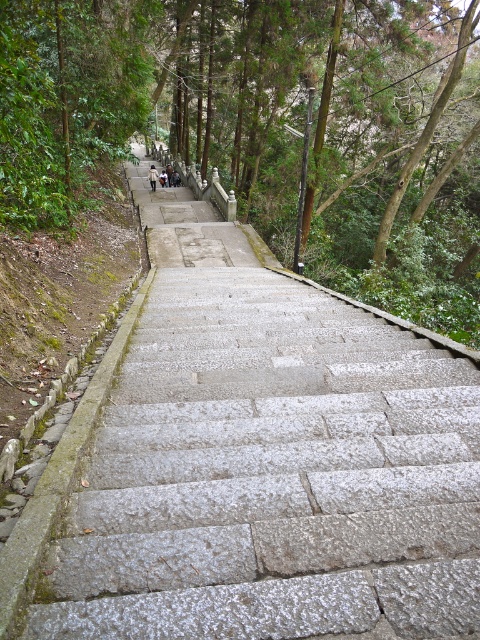
Can you confirm if gray stone stairs at center is bigger than green leafy tree at upper center?

Actually, gray stone stairs at center might be smaller than green leafy tree at upper center.

Can you confirm if gray stone stairs at center is positioned above green leafy tree at upper center?

No.

Between point (437, 493) and point (222, 36), which one is positioned behind?

Point (222, 36)

This screenshot has width=480, height=640. What are the coordinates of `gray stone stairs at center` in the screenshot? It's located at point(272,476).

Is gray stone stairs at center to the right of dark gray stone steps at upper center from the viewer's perspective?

Indeed, gray stone stairs at center is positioned on the right side of dark gray stone steps at upper center.

I want to click on gray stone stairs at center, so click(x=272, y=476).

Is point (126, 400) positioned after point (155, 180)?

No, it is not.

Where is `gray stone stairs at center`? gray stone stairs at center is located at coordinates (272, 476).

Does green leafy tree at upper center have a lesser width compared to dark gray stone steps at upper center?

No, green leafy tree at upper center is not thinner than dark gray stone steps at upper center.

Who is lower down, green leafy tree at upper center or dark gray stone steps at upper center?

dark gray stone steps at upper center is below.

Does point (396, 122) come in front of point (149, 177)?

Yes, it is in front of point (149, 177).

The image size is (480, 640). In order to click on green leafy tree at upper center in this screenshot , I will do `click(252, 109)`.